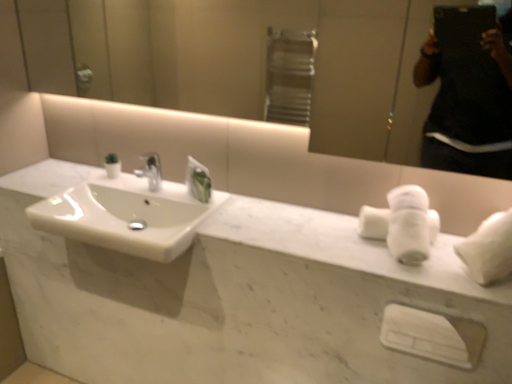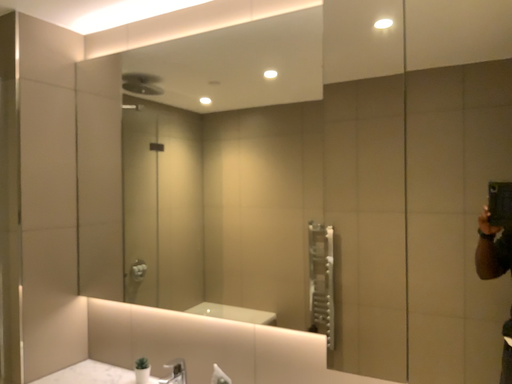
Question: Which way did the camera rotate in the video?

Choices:
 (A) rotated right
 (B) rotated left

Answer: (B)